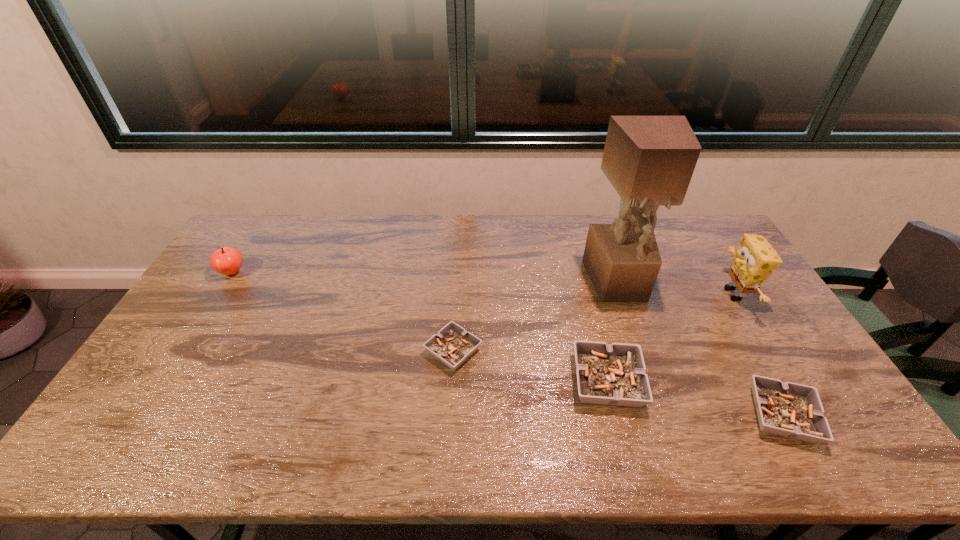
Image resolution: width=960 pixels, height=540 pixels. Identify the location of sponge present at the right edge. (755, 259).

The width and height of the screenshot is (960, 540). In order to click on object that is at the near right corner in this screenshot , I will do `click(792, 410)`.

Locate an element on the screen. The height and width of the screenshot is (540, 960). free space at the far edge of the desktop is located at coordinates (428, 250).

Find the location of a particular element. vacant space at the near edge of the desktop is located at coordinates coord(671,411).

In the image, there is a desktop. What are the coordinates of `free region at the left edge` in the screenshot? It's located at (235, 307).

You are a GUI agent. You are given a task and a screenshot of the screen. Output one action in this format:
    pyautogui.click(x=<x>, y=<y>)
    Task: Click on the free space at the right edge of the desktop
    Image resolution: width=960 pixels, height=540 pixels.
    Given the screenshot: What is the action you would take?
    pyautogui.click(x=753, y=298)

Where is `vacant area between the sculpture and the second ashtray from right to left`? This screenshot has height=540, width=960. vacant area between the sculpture and the second ashtray from right to left is located at coordinates (612, 332).

I want to click on unoccupied area between the tallest ashtray and the sponge, so click(x=670, y=338).

The width and height of the screenshot is (960, 540). I want to click on empty space that is in between the second object from left to right and the tallest ashtray, so click(x=530, y=366).

Find the location of a particular element. vacant area that lies between the sponge and the rightmost ashtray is located at coordinates (758, 355).